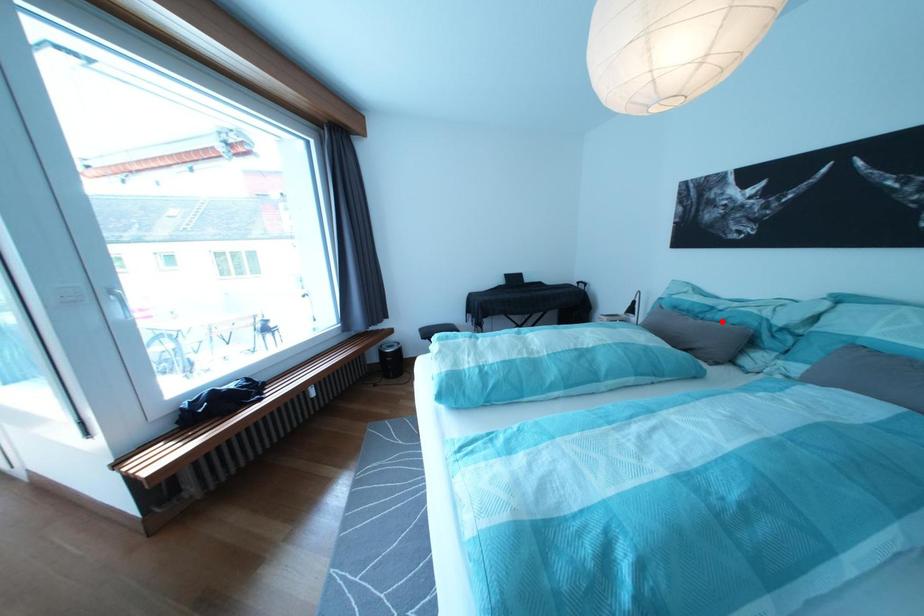
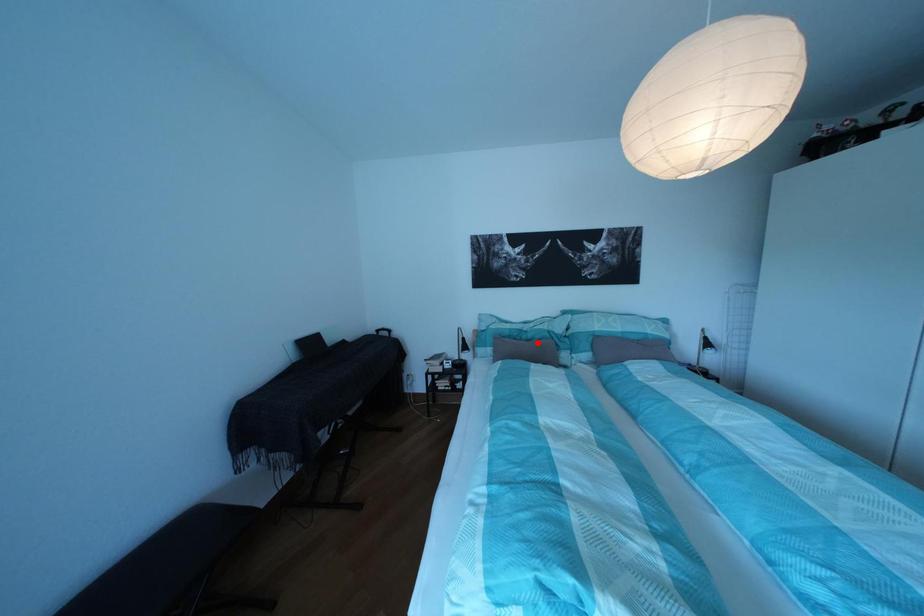
I am providing you with two images of the same scene from different viewpoints. A red point is marked on the first image and another point is marked on the second image. Does the point marked in image1 correspond to the same location as the one in image2?

Yes